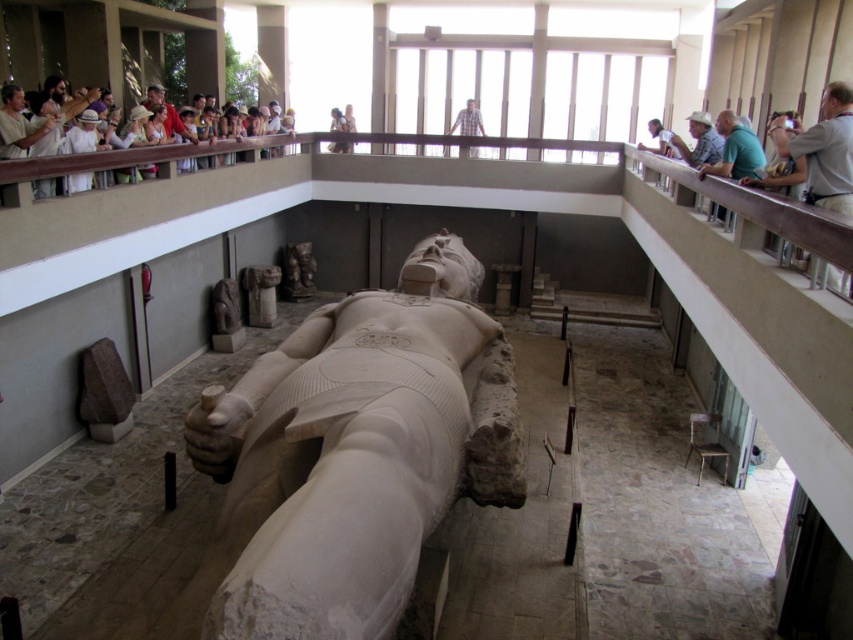
You are an art conservator examining the indoor museum scene. You notice the smooth stone statue at center and the plaid shirt at upper center. Based on their sizes, which object would require a larger storage container for preservation?

The plaid shirt at upper center requires a larger storage container because it is bigger than the smooth stone statue at center.

You are an art conservator standing at the entrance of the museum room. You need to place a protective barrier around the dark brown stone statue at center. The barrier must be placed exactly at point (x=297, y=272). Can you confirm if the barrier will be directly on top of the statue?

Yes, the barrier will be directly on top of the dark brown stone statue at center because the description states that at point (x=297, y=272) lies the statue.

You are a visitor at the museum and want to take a photo of the smooth stone statue at center without the plaid shirt at upper center appearing in the background. Given that your camera has a maximum zoom range of 100 feet, can you achieve this?

The distance between the smooth stone statue at center and the plaid shirt at upper center is 30.56 feet, which is within the camera maximum zoom range of 100 feet. Therefore, you can take the photo without the plaid shirt at upper center in the background.